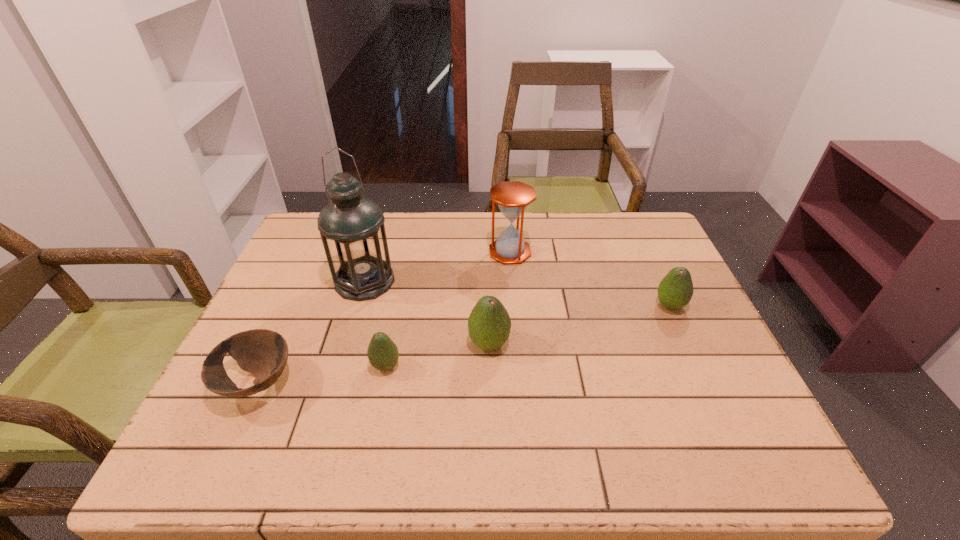
Identify the location of vacant space at the far edge of the desktop. (590, 228).

Identify the location of free region at the near edge. (466, 394).

This screenshot has height=540, width=960. What are the coordinates of `vacant space at the left edge` in the screenshot? It's located at (327, 271).

Image resolution: width=960 pixels, height=540 pixels. In order to click on vacant region at the right edge of the desktop in this screenshot , I will do `click(663, 335)`.

Locate an element on the screen. vacant space at the near left corner is located at coordinates (272, 388).

Where is `vacant space at the far right corner`? The image size is (960, 540). vacant space at the far right corner is located at coordinates (636, 251).

This screenshot has height=540, width=960. What are the coordinates of `vacant space that's between the oil lamp and the rightmost object` in the screenshot? It's located at (517, 293).

The image size is (960, 540). I want to click on free space between the hourglass and the leftmost object, so click(x=384, y=318).

Identify the location of vacant area that lies between the rightmost object and the second tallest object. (589, 279).

At what (x,y) coordinates should I click in order to perform the action: click on vacant space that is in between the hourglass and the rightmost avocado. Please return your answer as a coordinate pair (x, y). The height and width of the screenshot is (540, 960). Looking at the image, I should click on (589, 279).